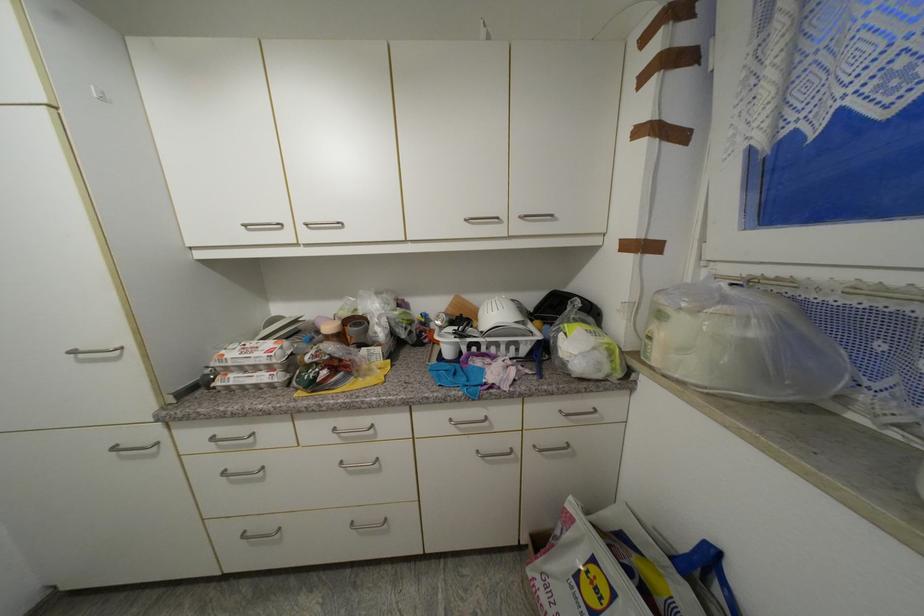
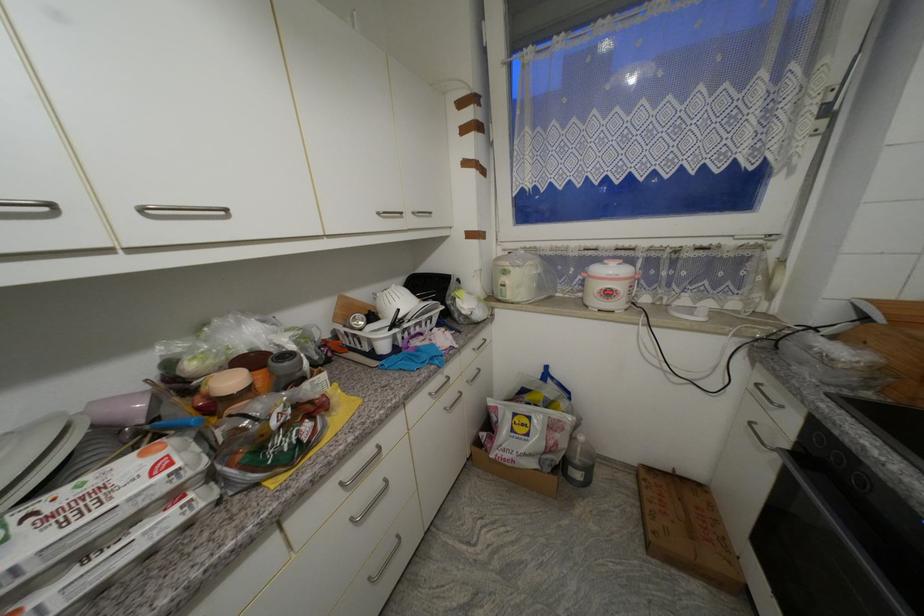
Locate, in the second image, the point that corresponds to point (358, 524) in the first image.

(375, 581)